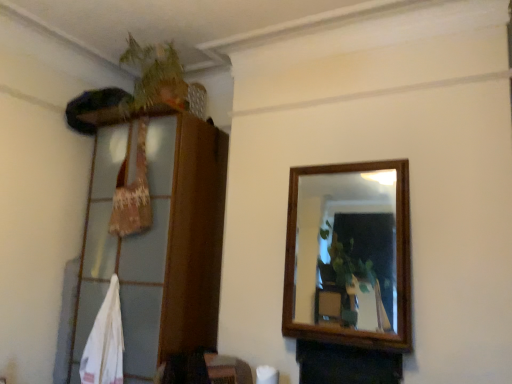
Question: Relative to wooden dresser at left, is green leafy plant at upper left in front or behind?

Choices:
 (A) behind
 (B) front

Answer: (A)

Question: From the image's perspective, is green leafy plant at upper left above or below wooden dresser at left?

Choices:
 (A) below
 (B) above

Answer: (B)

Question: Considering the positions of green leafy plant at upper left and wooden dresser at left in the image, is green leafy plant at upper left wider or thinner than wooden dresser at left?

Choices:
 (A) thin
 (B) wide

Answer: (A)

Question: From a real-world perspective, relative to green leafy plant at upper left, is wooden dresser at left vertically above or below?

Choices:
 (A) below
 (B) above

Answer: (A)

Question: From the image's perspective, is wooden dresser at left positioned above or below green leafy plant at upper left?

Choices:
 (A) below
 (B) above

Answer: (A)

Question: In terms of size, does wooden dresser at left appear bigger or smaller than green leafy plant at upper left?

Choices:
 (A) big
 (B) small

Answer: (A)

Question: Is wooden dresser at left wider or thinner than green leafy plant at upper left?

Choices:
 (A) thin
 (B) wide

Answer: (B)